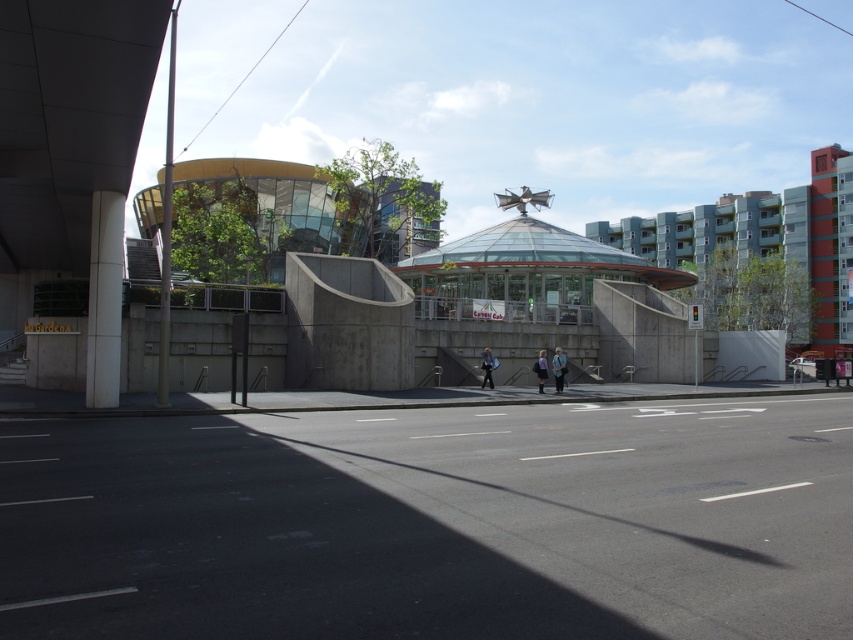
Question: Estimate the real-world distances between objects in this image. Which object is farther from the purple fabric bag at center?

Choices:
 (A) blue denim jacket at center
 (B) light blue denim jacket at center

Answer: (B)

Question: Is light blue denim jacket at center wider than purple fabric bag at center?

Choices:
 (A) yes
 (B) no

Answer: (B)

Question: Where is blue denim jacket at center located in relation to light blue denim jacket at center in the image?

Choices:
 (A) left
 (B) right

Answer: (B)

Question: Which of these objects is positioned closest to the light blue denim jacket at center?

Choices:
 (A) blue denim jacket at center
 (B) purple fabric bag at center

Answer: (B)

Question: Among these points, which one is farthest from the camera?

Choices:
 (A) (563, 356)
 (B) (544, 372)

Answer: (A)

Question: Does light blue denim jacket at center come behind purple fabric bag at center?

Choices:
 (A) no
 (B) yes

Answer: (B)